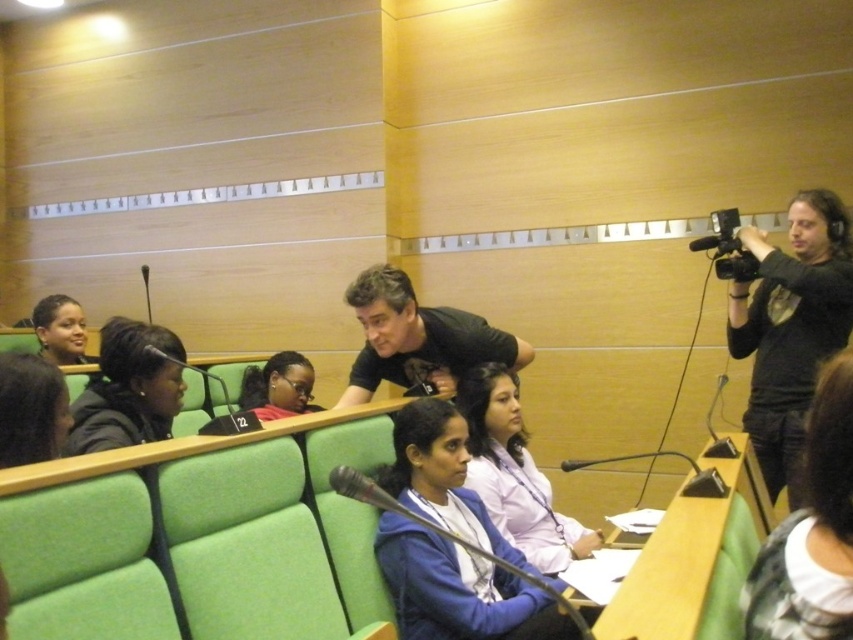
You are attending a conference and notice two people at the front of the room wearing the black matte shirt at center and the light purple shirt at center. Which one is sitting to the right?

The light purple shirt at center is sitting to the right because the black matte shirt at center is positioned on the left side of it.

You are organizing a group photo and need to arrange two people in the front row. The black matte shirt at center and the light purple shirt at center are candidates. Based on their sizes in the image, which one should you place on the left to ensure they both fit comfortably in the frame?

The black matte shirt at center might be wider than light purple shirt at center, so placing the black matte shirt at center on the left would allow both to fit comfortably as it occupies more space.